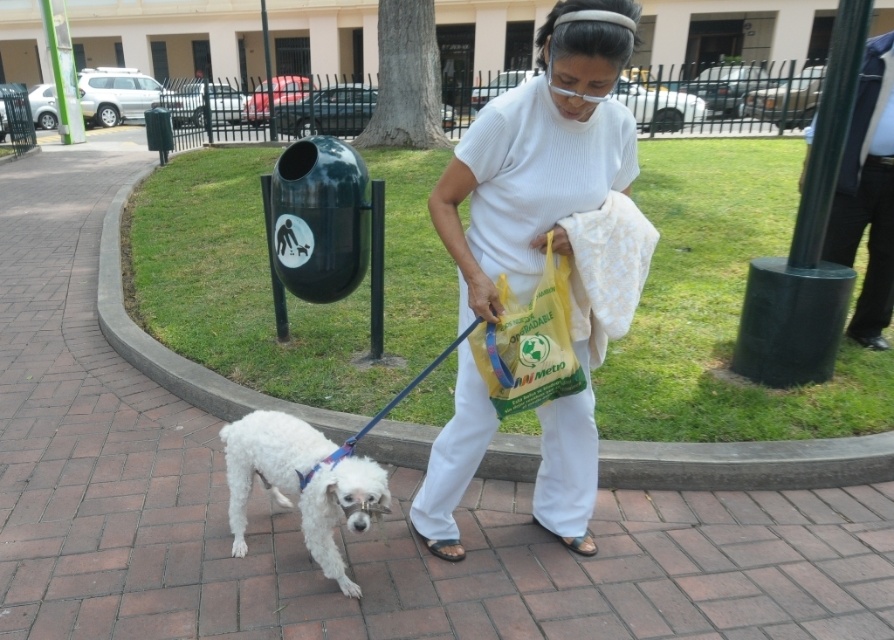
Which is below, white ribbed shirt at center or white fluffy dog at lower left?

white fluffy dog at lower left

From the picture: Can you confirm if white ribbed shirt at center is wider than white fluffy dog at lower left?

Incorrect, white ribbed shirt at center's width does not surpass white fluffy dog at lower left's.

Locate an element on the screen. The width and height of the screenshot is (894, 640). white ribbed shirt at center is located at coordinates (538, 156).

The image size is (894, 640). I want to click on white ribbed shirt at center, so click(538, 156).